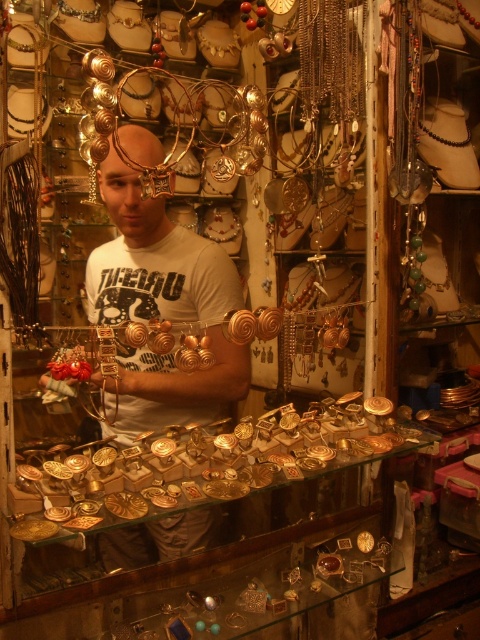
Is gold shiny belt buckle at center to the right of white matte t-shirt at center from the viewer's perspective?

Correct, you'll find gold shiny belt buckle at center to the right of white matte t-shirt at center.

Does gold shiny belt buckle at center have a greater width compared to white matte t-shirt at center?

Yes, gold shiny belt buckle at center is wider than white matte t-shirt at center.

The image size is (480, 640). What are the coordinates of `gold shiny belt buckle at center` in the screenshot? It's located at point(216,476).

What are the coordinates of `gold shiny belt buckle at center` in the screenshot? It's located at (216, 476).